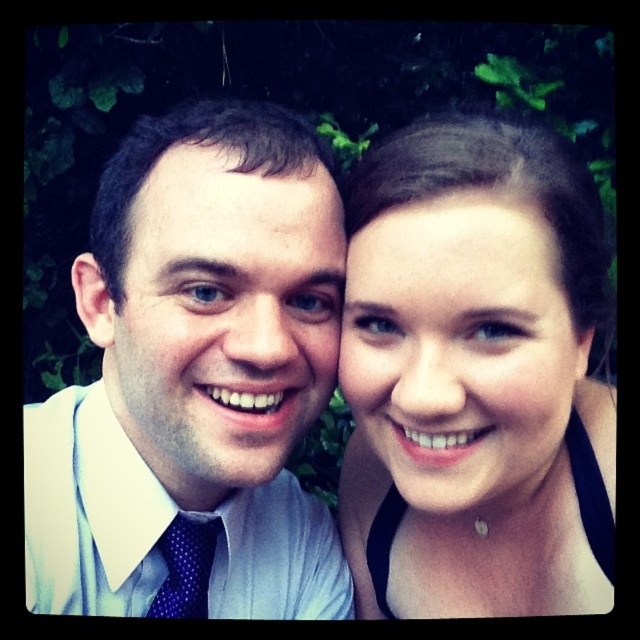
Question: Which point is farther to the camera?

Choices:
 (A) blue dotted tie at lower left
 (B) matte skin at center

Answer: (A)

Question: Can you confirm if matte skin at center is positioned above blue dotted tie at lower left?

Choices:
 (A) no
 (B) yes

Answer: (B)

Question: Does matte skin at center appear over blue dotted tie at lower left?

Choices:
 (A) yes
 (B) no

Answer: (A)

Question: Which of the following is the closest to the observer?

Choices:
 (A) matte skin at center
 (B) blue dotted tie at lower left

Answer: (A)

Question: Is matte skin at center wider than blue dotted tie at lower left?

Choices:
 (A) yes
 (B) no

Answer: (A)